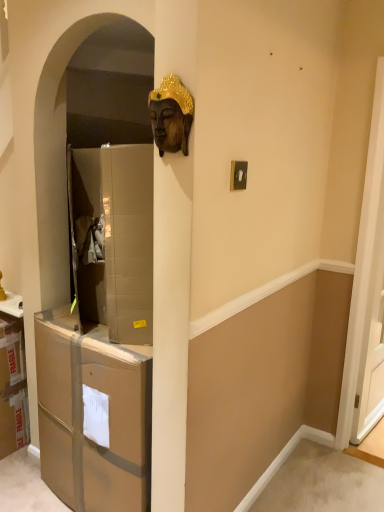
Question: In terms of height, does brown cardboard drawer at left look taller or shorter compared to white glossy screen door at right?

Choices:
 (A) short
 (B) tall

Answer: (A)

Question: From a real-world perspective, relative to white glossy screen door at right, is brown cardboard drawer at left vertically above or below?

Choices:
 (A) below
 (B) above

Answer: (A)

Question: Which of these objects is positioned closest to the white glossy screen door at right?

Choices:
 (A) brown cardboard drawer at left
 (B) bronze statue at upper center

Answer: (A)

Question: Estimate the real-world distances between objects in this image. Which object is farther from the white glossy screen door at right?

Choices:
 (A) brown cardboard drawer at left
 (B) bronze statue at upper center

Answer: (B)